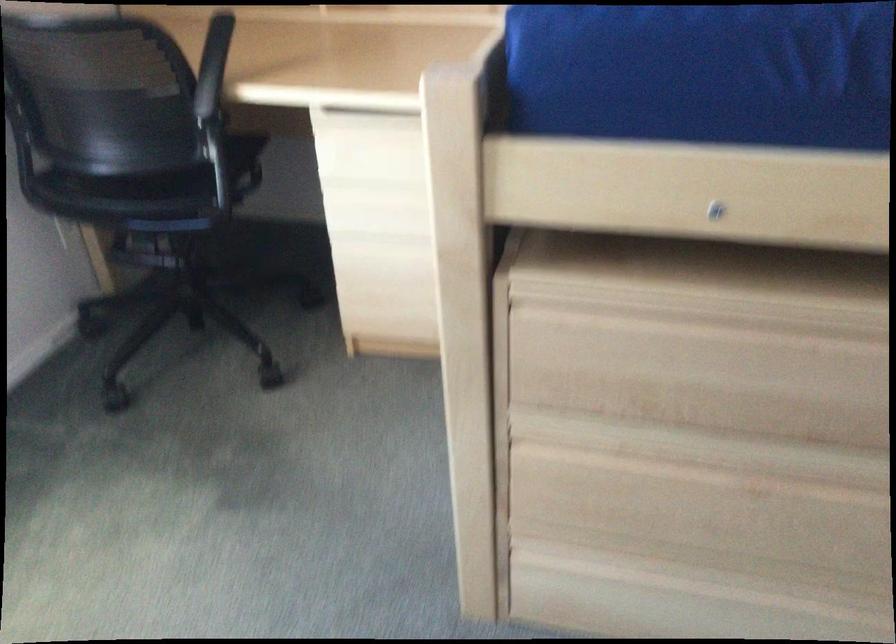
Identify the location of black chair armrest. (212, 66).